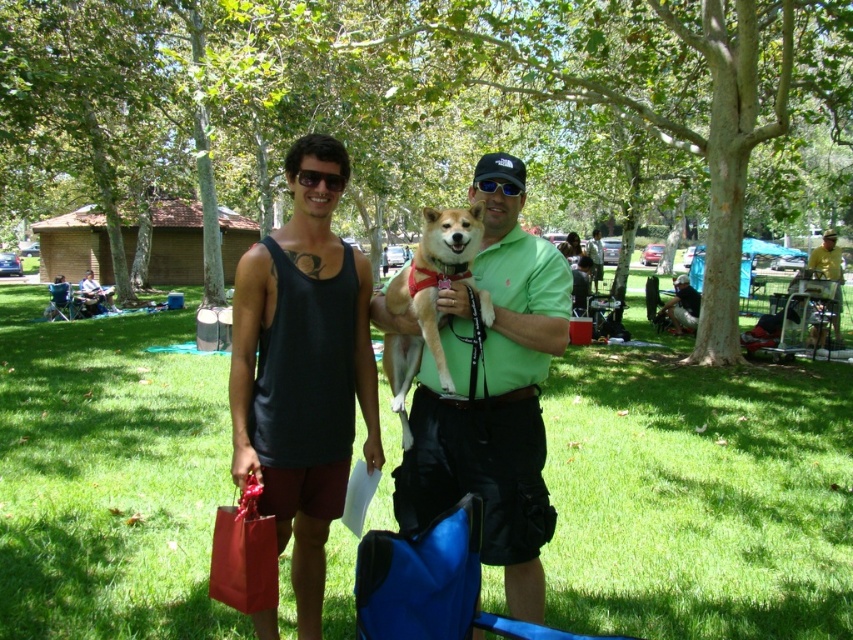
You are taking a photo of two people in a park. You notice the green cotton shirt at center and sunglasses at center. Which object is larger in the photo?

The green cotton shirt at center is bigger than sunglasses at center in the photo.

You are a photographer trying to focus on the green cotton shirt at center and the sunglasses at center. Which object should you adjust your camera focus on first if you want to capture both in sharp detail?

The green cotton shirt at center is closer to the viewer than sunglasses at center, so you should focus on the sunglasses at center first since it is farther away to ensure both are in focus.

You are a photographer who wants to ensure that both the black tank top at center and the green matte shirt at center are visible in the photo. Based on their positions, which one is closer to the bottom of the image?

The black tank top at center is located below the green matte shirt at center, so it is closer to the bottom of the image.